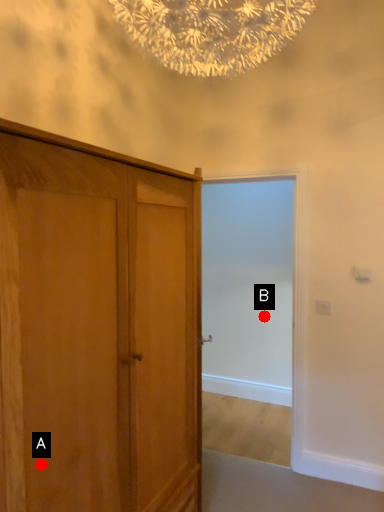
Question: Two points are circled on the image, labeled by A and B beside each circle. Which point is farther from the camera taking this photo?

Choices:
 (A) A is further
 (B) B is further

Answer: (B)